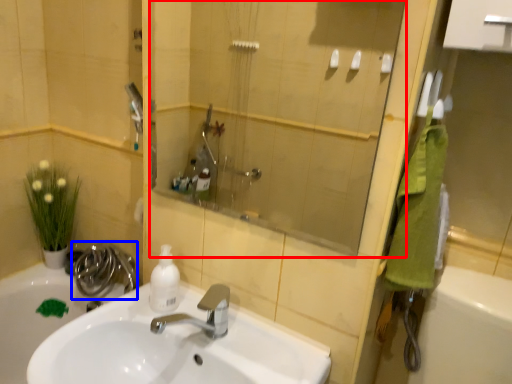
Question: Which of the following is the farthest to the observer, mirror (highlighted by a red box) or plumbing fixture (highlighted by a blue box)?

Choices:
 (A) mirror
 (B) plumbing fixture

Answer: (B)